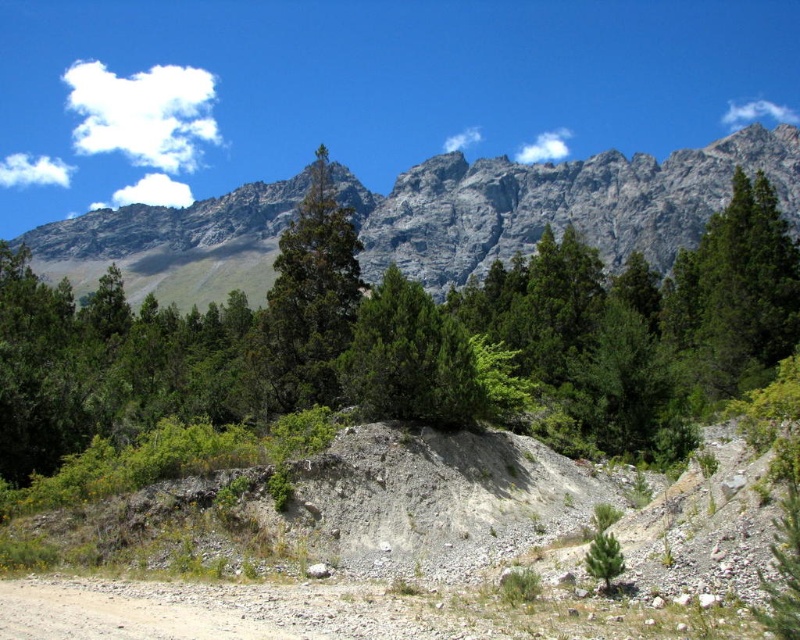
You are a hiker planning to reach the base of the green matte tree at center. From your current position at the gray rock mountain at upper center, which direction should you move to get there?

The gray rock mountain at upper center is positioned on the left side of the green matte tree at center. Therefore, you should move to the right to reach the base of the green matte tree at center from the gray rock mountain at upper center.

You are a hiker standing at the bottom left corner of the image where the dirt path is. You want to reach the green textured tree at upper center. If your average walking speed is 1.4 meters per second, how many minutes will it take you to reach the tree?

The distance to the green textured tree at upper center is 60.91 meters. Dividing the distance by the walking speed of 1.4 meters per second gives approximately 43.5 seconds, which is roughly 0.725 minutes. However, since the path may not be straight or direct, the actual time could be longer. But based on the given distance, it would take about 0.725 minutes.